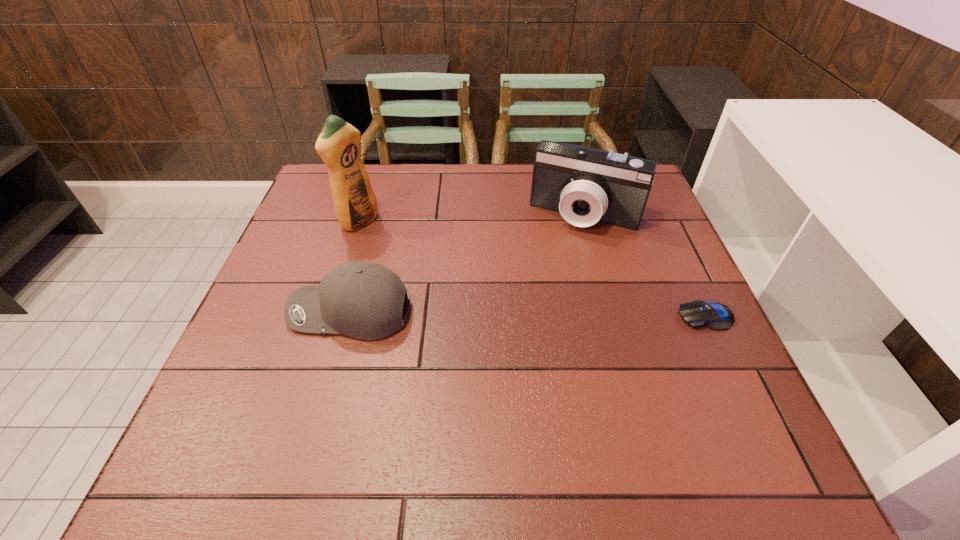
The image size is (960, 540). Find the location of `object present at the far right corner`. object present at the far right corner is located at coordinates (585, 185).

Where is `vacant space at the far edge`? The image size is (960, 540). vacant space at the far edge is located at coordinates (518, 209).

Identify the location of free space at the near edge of the desktop. The width and height of the screenshot is (960, 540). (348, 396).

Where is `free space at the left edge of the desktop`? The width and height of the screenshot is (960, 540). free space at the left edge of the desktop is located at coordinates (313, 278).

At what (x,y) coordinates should I click in order to perform the action: click on free space at the right edge of the desktop. Please return your answer as a coordinate pair (x, y). Looking at the image, I should click on (620, 253).

The height and width of the screenshot is (540, 960). What are the coordinates of `free space at the far left corner of the desktop` in the screenshot? It's located at (312, 206).

In order to click on free location at the near right corner in this screenshot , I will do `click(738, 397)`.

Identify the location of blank region between the baseball cap and the shortest object. (528, 314).

At what (x,y) coordinates should I click in order to perform the action: click on vacant space that's between the camcorder and the detergent. Please return your answer as a coordinate pair (x, y). Looking at the image, I should click on pyautogui.click(x=472, y=218).

The width and height of the screenshot is (960, 540). Identify the location of vacant area that lies between the third tallest object and the camcorder. (468, 264).